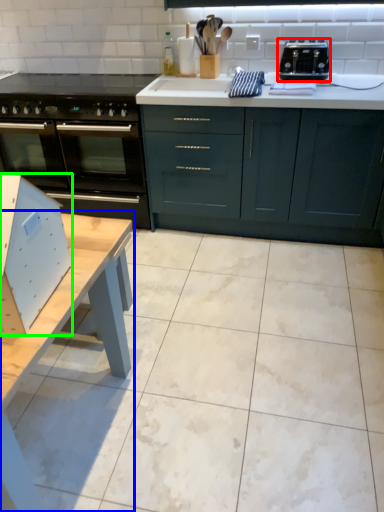
Question: Estimate the real-world distances between objects in this image. Which object is farther from toaster (highlighted by a red box), table (highlighted by a blue box) or appliance (highlighted by a green box)?

Choices:
 (A) table
 (B) appliance

Answer: (B)